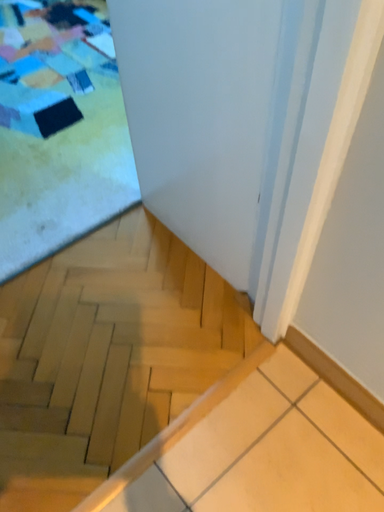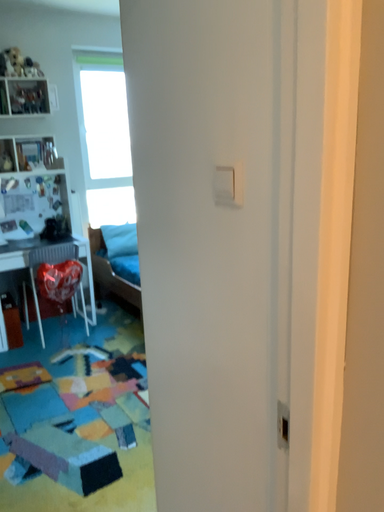
Question: Which way did the camera rotate in the video?

Choices:
 (A) rotated downward
 (B) rotated upward

Answer: (B)